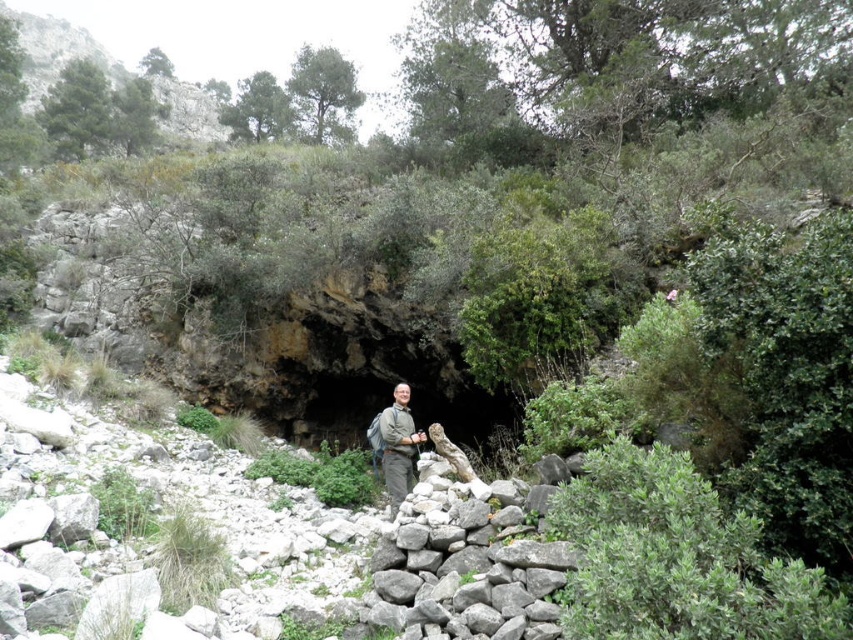
Question: Is gray rough stone at center to the right of khaki fabric jacket at center from the viewer's perspective?

Choices:
 (A) no
 (B) yes

Answer: (B)

Question: In this image, where is gray rough stone at center located relative to khaki fabric jacket at center?

Choices:
 (A) right
 (B) left

Answer: (A)

Question: Is gray rough stone at center below khaki fabric jacket at center?

Choices:
 (A) no
 (B) yes

Answer: (B)